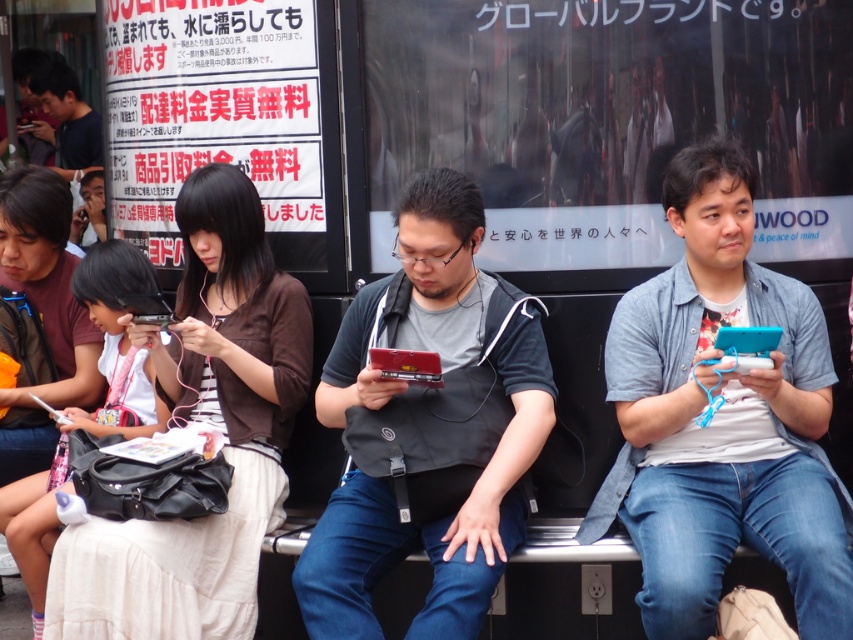
Question: Is blue matte phone at right to the left of matte black handheld gaming console at center from the viewer's perspective?

Choices:
 (A) no
 (B) yes

Answer: (A)

Question: From the image, what is the correct spatial relationship of blue matte phone at right in relation to matte black handheld gaming console at center?

Choices:
 (A) above
 (B) below

Answer: (A)

Question: Which point is farther from the camera taking this photo?

Choices:
 (A) (732, 225)
 (B) (352, 499)

Answer: (A)

Question: Which object is farther from the camera taking this photo?

Choices:
 (A) matte black handheld gaming console at center
 (B) blue matte phone at right

Answer: (A)

Question: Does blue matte phone at right appear on the right side of matte black handheld gaming console at center?

Choices:
 (A) yes
 (B) no

Answer: (A)